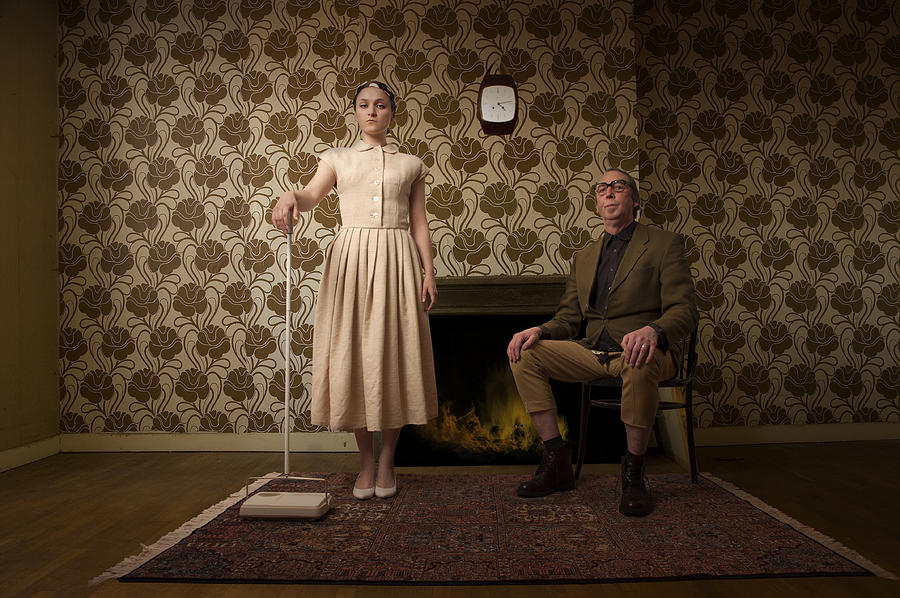
I want to click on dark red and brown and blue rug, so click(x=355, y=551).